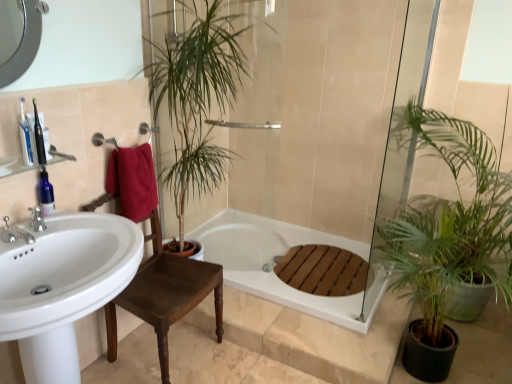
The height and width of the screenshot is (384, 512). Identify the location of spots to the right of silver metallic faucet at left, acting as the first tap starting from the back. (82, 229).